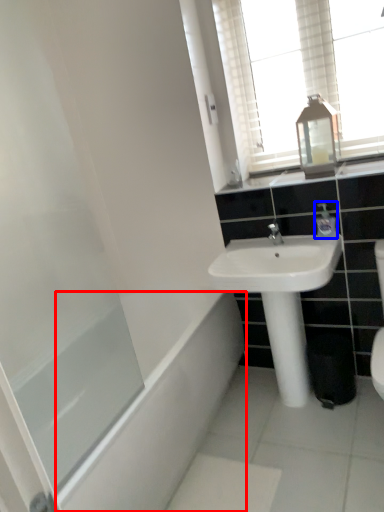
Question: Which object is further to the camera taking this photo, bath (highlighted by a red box) or toiletry (highlighted by a blue box)?

Choices:
 (A) bath
 (B) toiletry

Answer: (B)